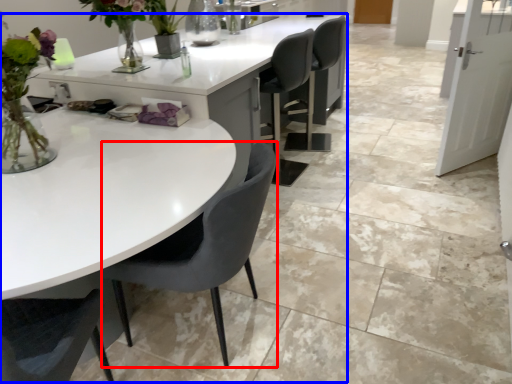
Question: Among these objects, which one is farthest to the camera, chair (highlighted by a red box) or table (highlighted by a blue box)?

Choices:
 (A) chair
 (B) table

Answer: (A)